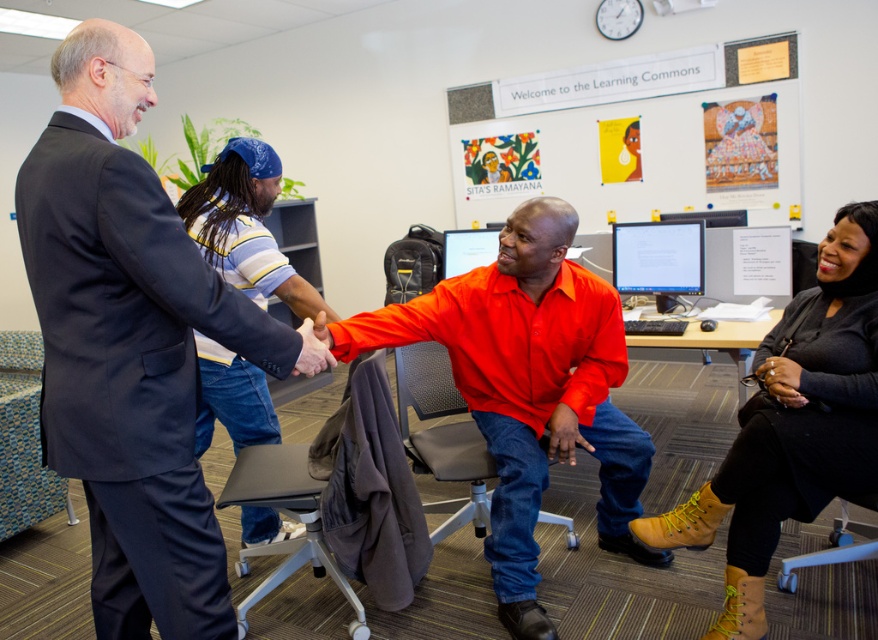
Question: Which of the following is the farthest from the observer?

Choices:
 (A) matte orange shirt at center
 (B) black knit sweater at lower right
 (C) matte black monitor at center

Answer: (C)

Question: Which point appears farthest from the camera in this image?

Choices:
 (A) (637, 236)
 (B) (724, 496)
 (C) (428, 339)

Answer: (A)

Question: Is dark blue suit at left above matte orange shirt at center?

Choices:
 (A) no
 (B) yes

Answer: (B)

Question: Does dark blue suit at left come behind matte orange shirt at center?

Choices:
 (A) no
 (B) yes

Answer: (A)

Question: Which object appears closest to the camera in this image?

Choices:
 (A) dark blue suit at left
 (B) black knit sweater at lower right

Answer: (A)

Question: Can you confirm if dark blue suit at left is thinner than black knit sweater at lower right?

Choices:
 (A) no
 (B) yes

Answer: (B)